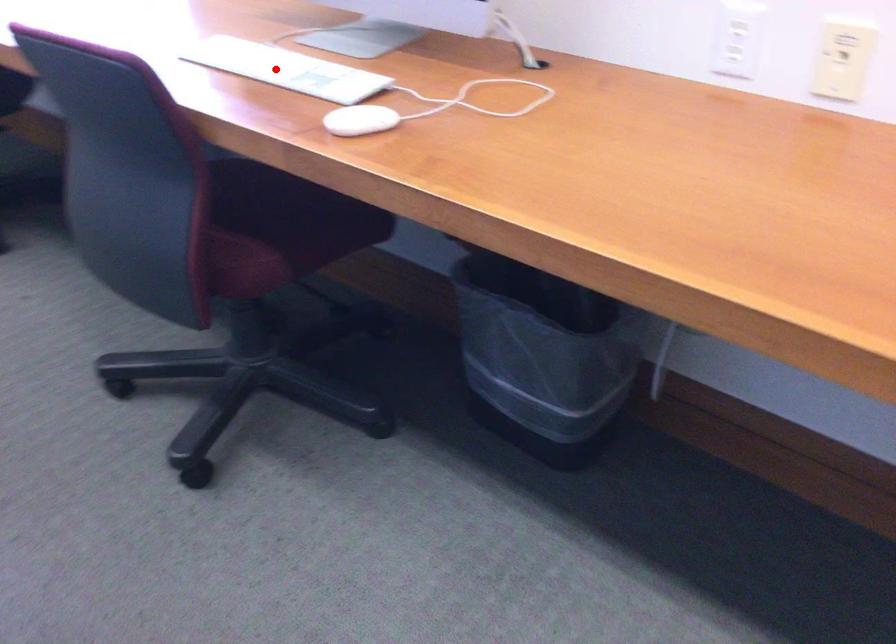
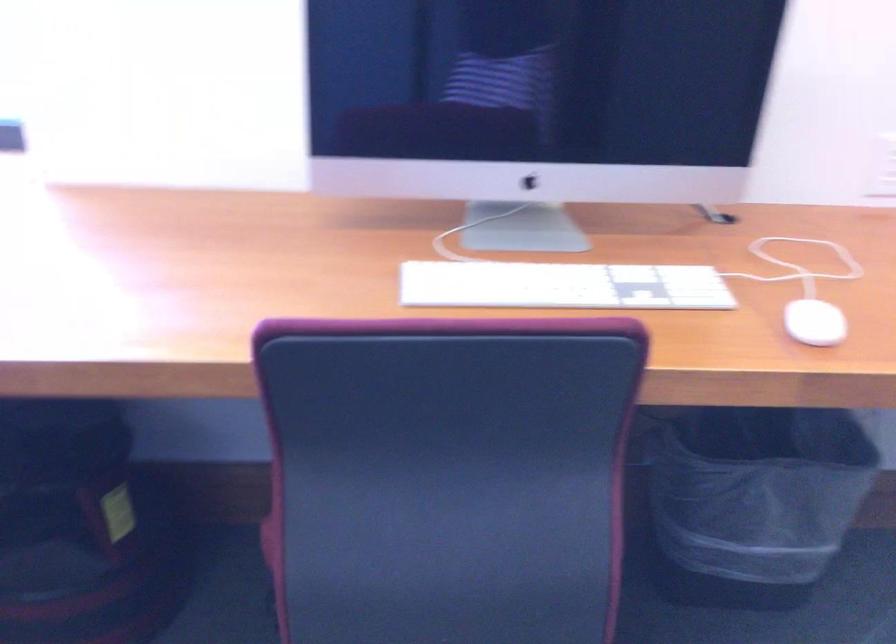
Question: I am providing you with two images of the same scene from different viewpoints. In image1, a red point is highlighted. Considering the same 3D point in image2, which of the following is correct?

Choices:
 (A) It is closer
 (B) It is farther

Answer: (A)